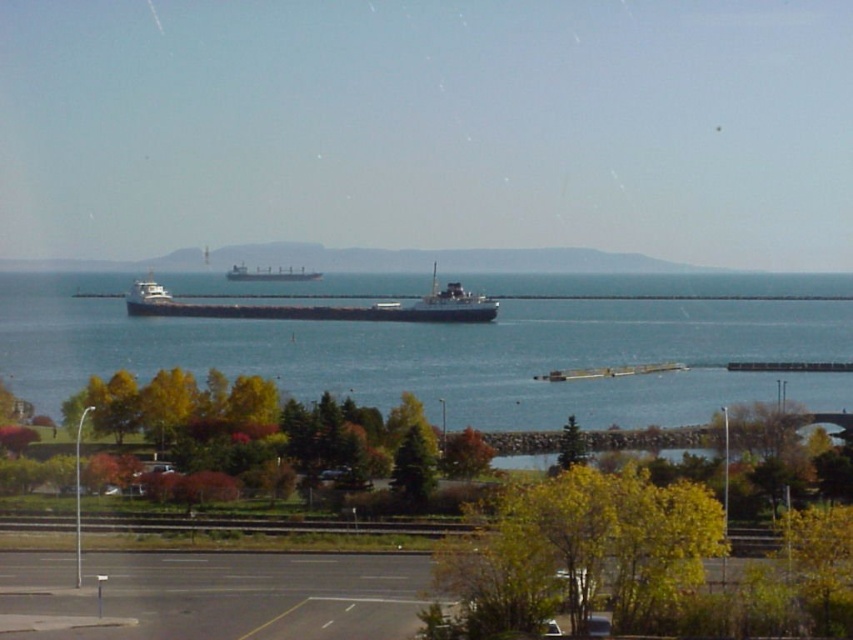
Question: Estimate the real-world distances between objects in this image. Which object is farther from the blue water at center?

Choices:
 (A) matte black ship at center
 (B) matte black cargo ship at center

Answer: (B)

Question: Which object is farther from the camera taking this photo?

Choices:
 (A) matte black ship at center
 (B) blue water at center
 (C) matte black cargo ship at center

Answer: (C)

Question: Which point is closer to the camera taking this photo?

Choices:
 (A) (254, 371)
 (B) (279, 280)

Answer: (A)

Question: Is blue water at center to the left of matte black cargo ship at center from the viewer's perspective?

Choices:
 (A) yes
 (B) no

Answer: (B)

Question: Observing the image, what is the correct spatial positioning of blue water at center in reference to matte black cargo ship at center?

Choices:
 (A) left
 (B) right

Answer: (B)

Question: Can you confirm if matte black ship at center is positioned below matte black cargo ship at center?

Choices:
 (A) no
 (B) yes

Answer: (B)